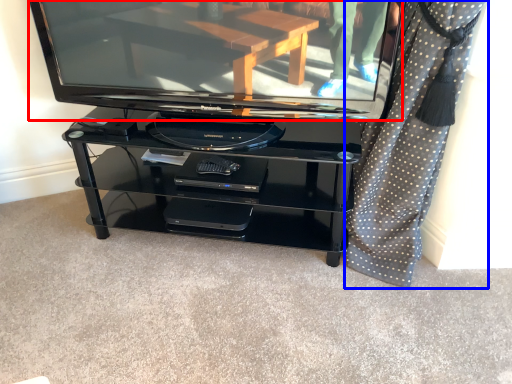
Question: Among these objects, which one is nearest to the camera, television (highlighted by a red box) or curtain (highlighted by a blue box)?

Choices:
 (A) television
 (B) curtain

Answer: (B)